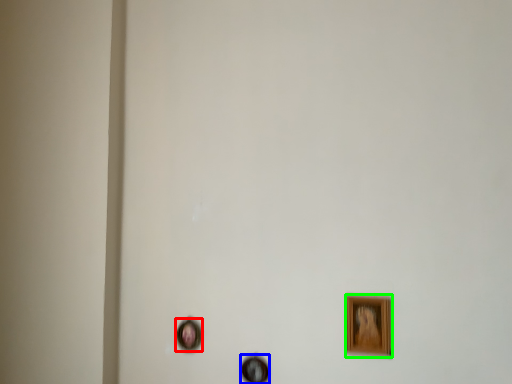
Question: Estimate the real-world distances between objects in this image. Which object is farther from picture frame (highlighted by a red box), picture frame (highlighted by a blue box) or picture frame (highlighted by a green box)?

Choices:
 (A) picture frame
 (B) picture frame

Answer: (B)